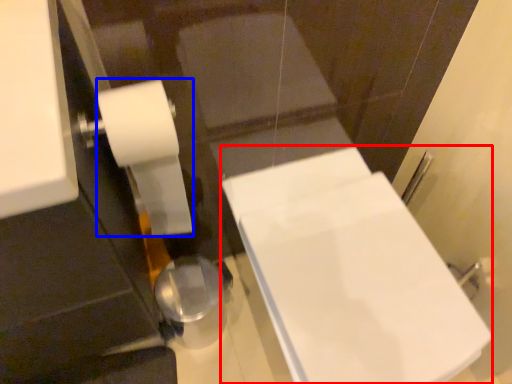
Question: Which of the following is the farthest to the observer, bath (highlighted by a red box) or toilet paper (highlighted by a blue box)?

Choices:
 (A) bath
 (B) toilet paper

Answer: (A)